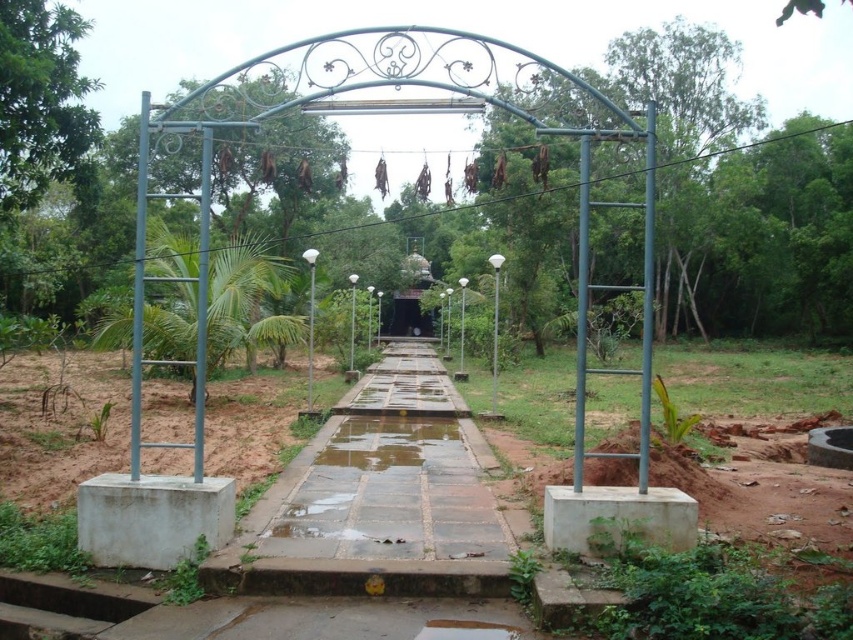
You are a maintenance worker checking the pathway. You see the wet concrete path at center and the glossy concrete puddle at center. Which one has a bigger area?

The wet concrete path at center has a larger size compared to the glossy concrete puddle at center, so the wet concrete path at center has a bigger area.

You are a gardener who needs to walk along the wet concrete path at center to reach the temple. There is a glossy concrete puddle at center in your path. Can you walk around the puddle without stepping off the path?

The wet concrete path at center is wider than the glossy concrete puddle at center, so yes, you can walk around the puddle without stepping off the path.

You are standing at the start of the pathway and want to walk to the temple structure ahead. Is the wet concrete path at center slippery enough to be dangerous?

The wet concrete path at center is located at point (387, 474), which is the center of the path. Since the path is paved with rectangular stone slabs and appears slightly wet, it might be slippery but not necessarily dangerous unless there is standing water or ice. The description does not mention such conditions, so proceed with caution but it is not explicitly dangerous.